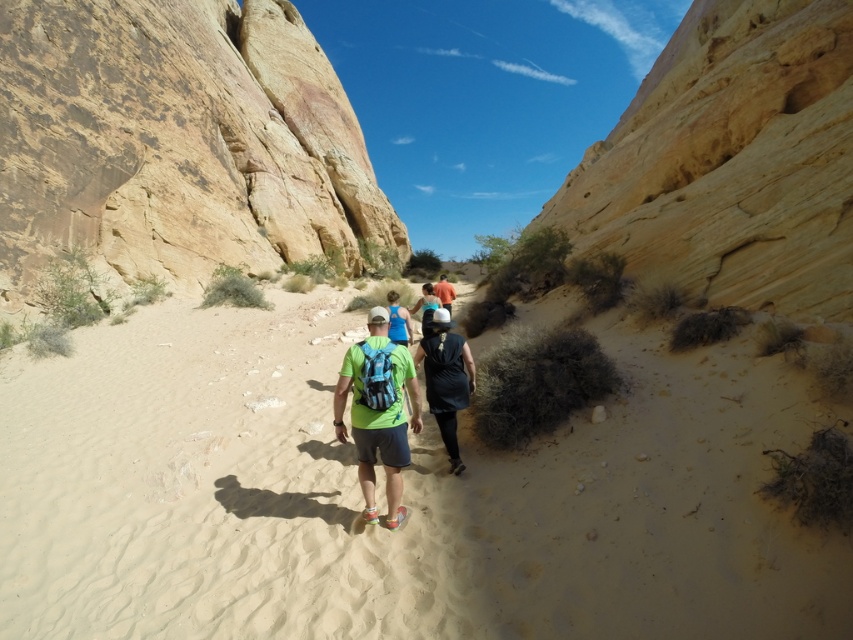
You are a hiker in the desert and you want to know if your black matte backpack at center can fit inside your orange fabric shirt at center. Can it fit?

The black matte backpack at center occupies less space than orange fabric shirt at center, so it can fit inside the orange fabric shirt at center.

You are a hiker planning to carry both the black matte backpack at center and the orange fabric shirt at center. If you want to place them side by side on a narrow ledge, which item should you place first to ensure both fit?

The black matte backpack at center has a smaller width than the orange fabric shirt at center, so you should place the black matte backpack at center first to ensure both items can fit side by side on the narrow ledge.